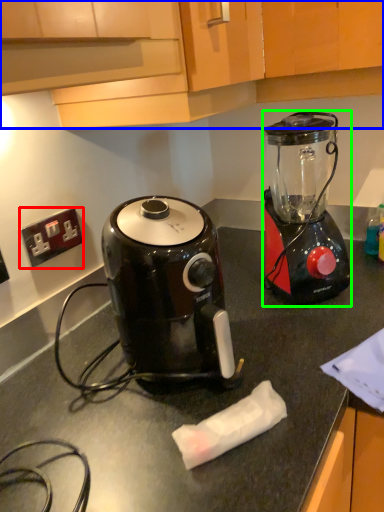
Question: Considering the real-world distances, which object is farthest from power outlet (highlighted by a red box)? cabinetry (highlighted by a blue box) or blender (highlighted by a green box)?

Choices:
 (A) cabinetry
 (B) blender

Answer: (B)